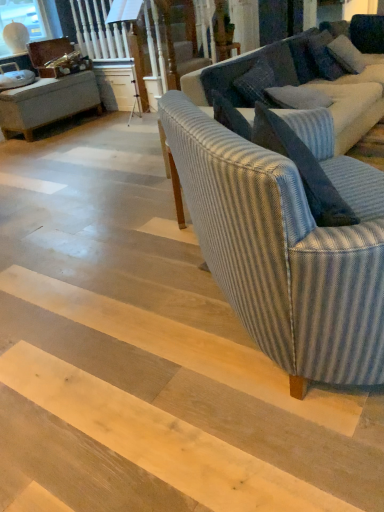
Question: Do you think blue striped pillow at upper right, positioned as the first pillow in front-to-back order, is within striped fabric couch at center, placed as the 1th studio couch when sorted from back to front, or outside of it?

Choices:
 (A) inside
 (B) outside

Answer: (A)

Question: Is blue striped pillow at upper right, arranged as the second pillow when viewed from the right, bigger or smaller than striped fabric couch at center, placed as the 1th studio couch when sorted from back to front?

Choices:
 (A) small
 (B) big

Answer: (A)

Question: Which is farther from the striped fabric couch at center, which ranks as the second studio couch in back-to-front order?

Choices:
 (A) striped fabric couch at center, arranged as the 2th studio couch when viewed from the front
 (B) dark gray textured pillow at upper right, the 1th pillow viewed from the right
 (C) blue striped pillow at upper right, positioned as the 1th pillow in bottom-to-top order

Answer: (B)

Question: Considering the real-world distances, which object is farthest from the striped fabric couch at center, arranged as the first studio couch when viewed from the front?

Choices:
 (A) blue striped pillow at upper right, arranged as the second pillow when viewed from the right
 (B) striped fabric couch at center, placed as the 1th studio couch when sorted from back to front
 (C) dark gray textured pillow at upper right, the 2th pillow from the left

Answer: (C)